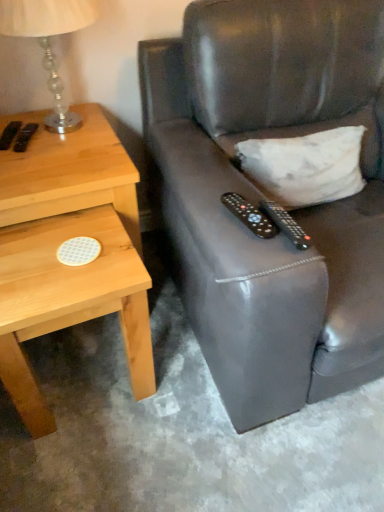
Question: Is translucent glass lamp at upper left inside the boundaries of white matte pillow at upper right, or outside?

Choices:
 (A) inside
 (B) outside

Answer: (B)

Question: From a real-world perspective, is translucent glass lamp at upper left above or below white matte pillow at upper right?

Choices:
 (A) above
 (B) below

Answer: (A)

Question: Which object is positioned farthest from the light wood/texture nightstand at left?

Choices:
 (A) black plastic remote control at center, the first remote control from the right
 (B) translucent glass lamp at upper left
 (C) white matte pillow at upper right
 (D) black plastic remote control at center, which is the 1th remote control in left-to-right order
 (E) leather couch at right

Answer: (C)

Question: Which is farther from the translucent glass lamp at upper left?

Choices:
 (A) leather couch at right
 (B) white matte pillow at upper right
 (C) black plastic remote control at center, which ranks as the second remote control in left-to-right order
 (D) black plastic remote control at center, which is the 1th remote control in left-to-right order
 (E) light wood/texture nightstand at left

Answer: (C)